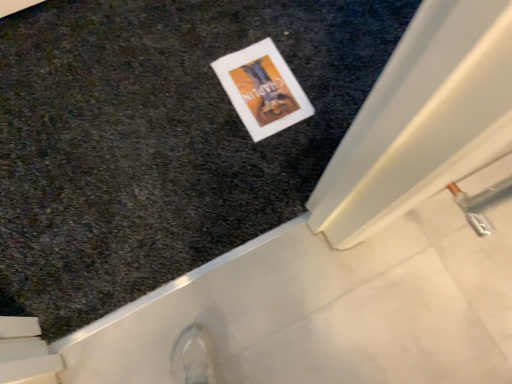
You are a GUI agent. You are given a task and a screenshot of the screen. Output one action in this format:
    pyautogui.click(x=<x>, y=<y>)
    Task: Click on the free spot above white paper at center (from a real-world perspective)
    Image resolution: width=512 pixels, height=384 pixels.
    Given the screenshot: What is the action you would take?
    pyautogui.click(x=261, y=82)